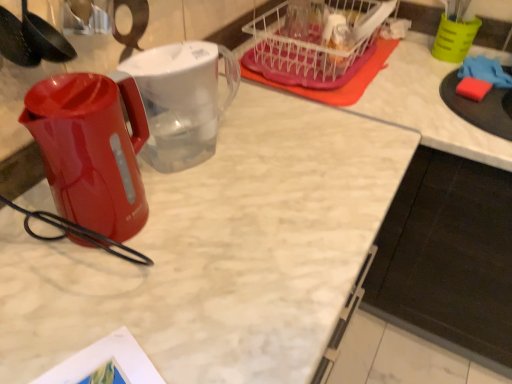
This screenshot has width=512, height=384. What are the coordinates of `vacant area that is in front of green plastic cup at upper right` in the screenshot? It's located at (436, 75).